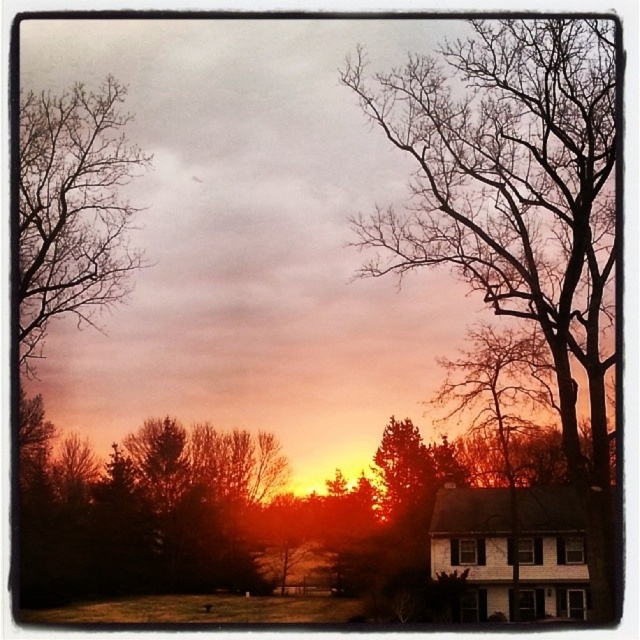
Question: Does bare branches at center come in front of bare branches at upper left?

Choices:
 (A) yes
 (B) no

Answer: (A)

Question: Where is bare branches at center located in relation to bare branches at upper left in the image?

Choices:
 (A) below
 (B) above

Answer: (A)

Question: Does bare branches at center lie in front of bare branches at upper left?

Choices:
 (A) yes
 (B) no

Answer: (A)

Question: Which point appears closest to the camera in this image?

Choices:
 (A) (74, 307)
 (B) (545, 365)

Answer: (B)